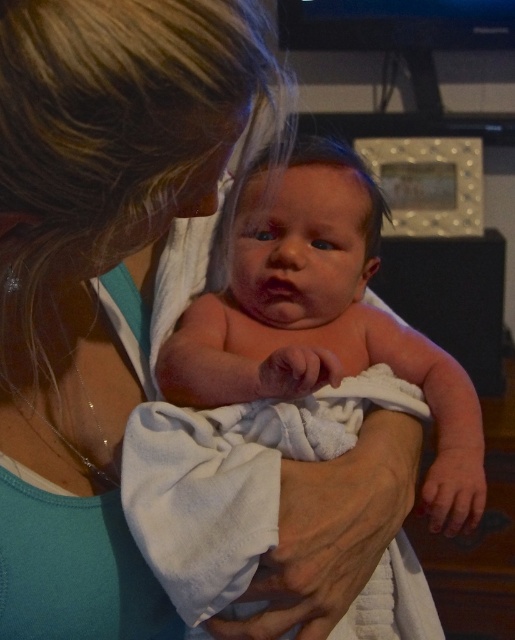
Question: Which point is farther from the camera taking this photo?

Choices:
 (A) (337, 253)
 (B) (89, 413)

Answer: (A)

Question: Can you confirm if blue fabric at center is bigger than pink soft towel at center?

Choices:
 (A) no
 (B) yes

Answer: (A)

Question: From the image, what is the correct spatial relationship of blue fabric at center in relation to pink soft towel at center?

Choices:
 (A) below
 (B) above

Answer: (B)

Question: Which point is farther from the camera taking this photo?

Choices:
 (A) (103, 428)
 (B) (285, 397)

Answer: (B)

Question: Is blue fabric at center smaller than pink soft towel at center?

Choices:
 (A) no
 (B) yes

Answer: (B)